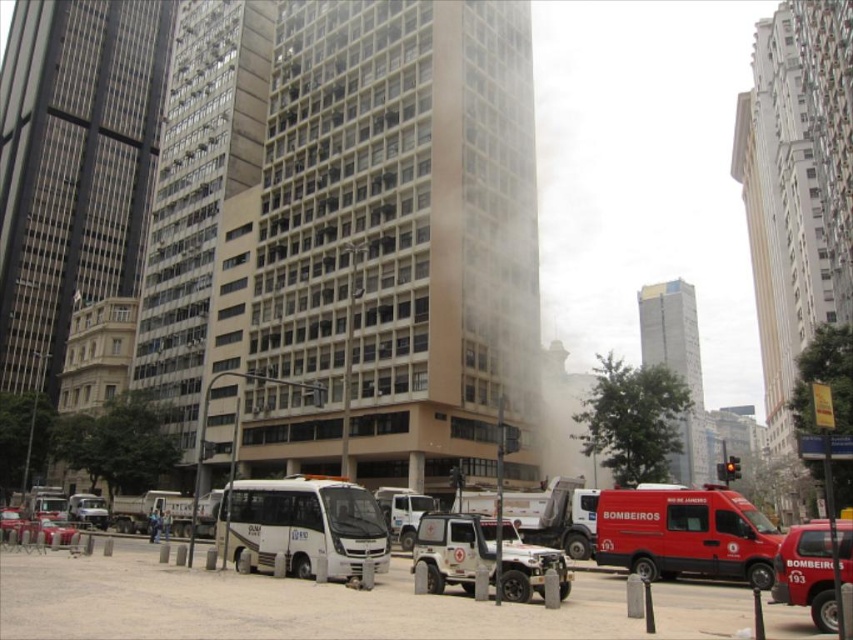
Is point (334, 499) farther from camera compared to point (64, 541)?

No, it is not.

Is white matte van at center taller than metallic silver car at lower left?

Yes, white matte van at center is taller than metallic silver car at lower left.

Where is `white matte van at center`? white matte van at center is located at coordinates (303, 525).

Identify the location of white matte van at center. The image size is (853, 640). (303, 525).

At what (x,y) coordinates should I click in order to perform the action: click on white matte emergency vehicle at center. Please return your answer as a coordinate pair (x, y). The height and width of the screenshot is (640, 853). Looking at the image, I should click on (454, 548).

Is white matte emergency vehicle at center to the right of metallic silver car at lower left from the viewer's perspective?

Yes, white matte emergency vehicle at center is to the right of metallic silver car at lower left.

This screenshot has height=640, width=853. What do you see at coordinates (454, 548) in the screenshot?
I see `white matte emergency vehicle at center` at bounding box center [454, 548].

The height and width of the screenshot is (640, 853). I want to click on white matte emergency vehicle at center, so click(x=454, y=548).

Is point (717, 547) farther from camera compared to point (431, 572)?

Yes, point (717, 547) is farther from viewer.

Who is positioned more to the left, matte red van at lower right or white matte emergency vehicle at center?

Positioned to the left is white matte emergency vehicle at center.

Based on the photo, who is more forward, (x=624, y=516) or (x=419, y=524)?

Positioned in front is point (x=419, y=524).

You are a GUI agent. You are given a task and a screenshot of the screen. Output one action in this format:
    pyautogui.click(x=<x>, y=<y>)
    Task: Click on the matte red van at lower right
    The image size is (853, 640).
    Given the screenshot: What is the action you would take?
    pyautogui.click(x=685, y=534)